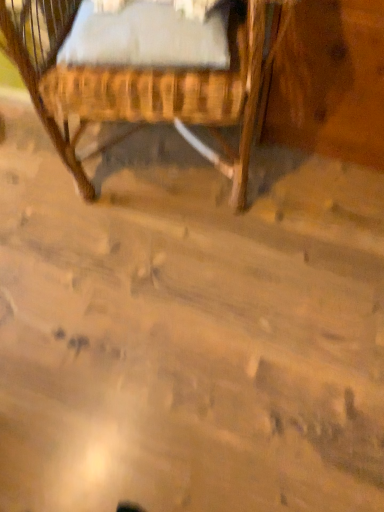
Question: Is woven wood crib at upper left positioned beyond the bounds of white soft fabric at upper center?

Choices:
 (A) no
 (B) yes

Answer: (B)

Question: Does woven wood crib at upper left lie in front of white soft fabric at upper center?

Choices:
 (A) no
 (B) yes

Answer: (B)

Question: From the image's perspective, is woven wood crib at upper left beneath white soft fabric at upper center?

Choices:
 (A) no
 (B) yes

Answer: (A)

Question: From a real-world perspective, is woven wood crib at upper left beneath white soft fabric at upper center?

Choices:
 (A) no
 (B) yes

Answer: (B)

Question: From a real-world perspective, is woven wood crib at upper left over white soft fabric at upper center?

Choices:
 (A) yes
 (B) no

Answer: (B)

Question: Considering the relative sizes of woven wood crib at upper left and white soft fabric at upper center in the image provided, is woven wood crib at upper left taller than white soft fabric at upper center?

Choices:
 (A) no
 (B) yes

Answer: (B)

Question: Is white soft fabric at upper center bigger than woven wood crib at upper left?

Choices:
 (A) yes
 (B) no

Answer: (B)

Question: From a real-world perspective, is white soft fabric at upper center located higher than woven wood crib at upper left?

Choices:
 (A) no
 (B) yes

Answer: (B)

Question: Does white soft fabric at upper center come behind woven wood crib at upper left?

Choices:
 (A) yes
 (B) no

Answer: (A)

Question: Is white soft fabric at upper center far from woven wood crib at upper left?

Choices:
 (A) no
 (B) yes

Answer: (A)

Question: Does white soft fabric at upper center appear on the right side of woven wood crib at upper left?

Choices:
 (A) yes
 (B) no

Answer: (A)

Question: Is white soft fabric at upper center wider than woven wood crib at upper left?

Choices:
 (A) yes
 (B) no

Answer: (B)

Question: Based on their sizes in the image, would you say white soft fabric at upper center is bigger or smaller than woven wood crib at upper left?

Choices:
 (A) big
 (B) small

Answer: (B)